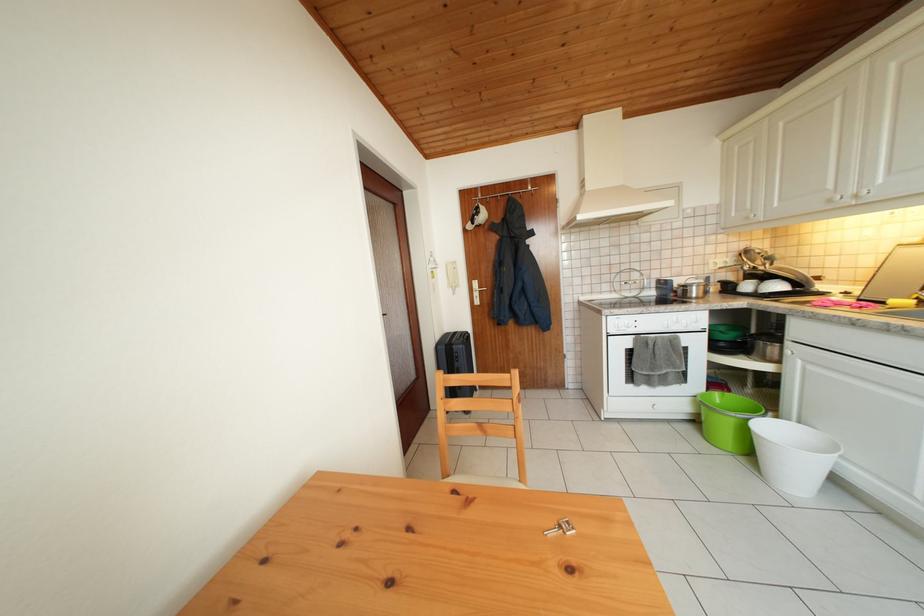
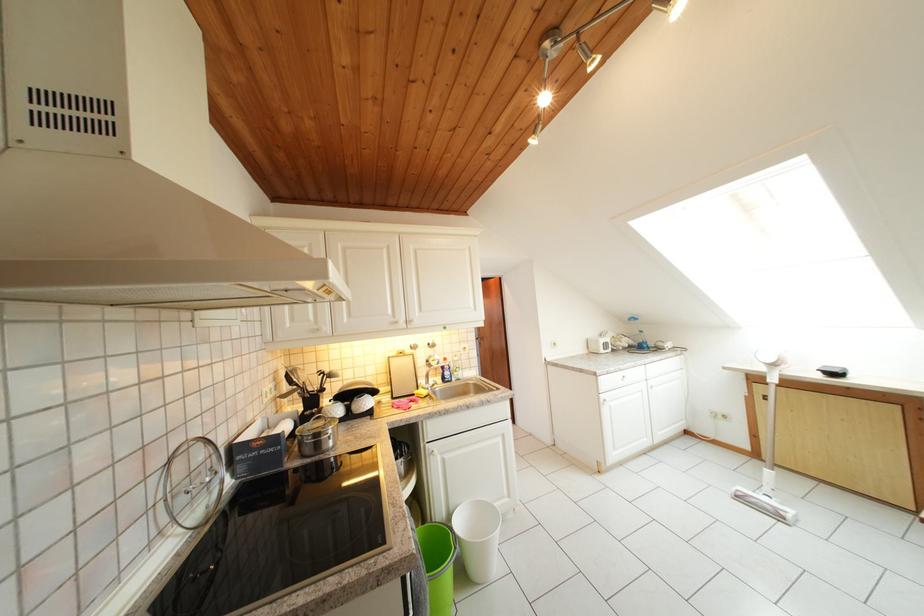
In the second image, find the point that corresponds to point 840,191 in the first image.

(398, 317)